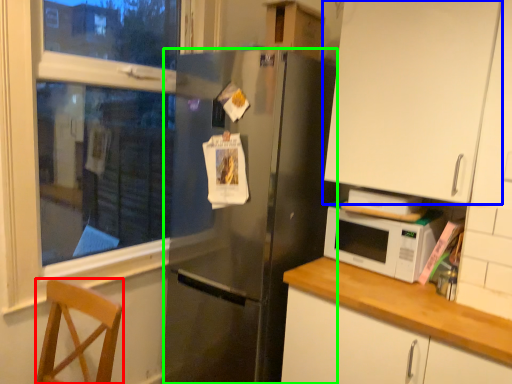
Question: Which object is positioned farthest from chair (highlighted by a red box)? Select from cabinetry (highlighted by a blue box) and refrigerator (highlighted by a green box).

Choices:
 (A) cabinetry
 (B) refrigerator

Answer: (A)